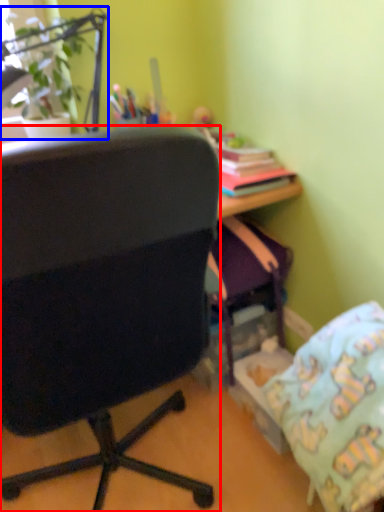
Question: Which object is further to the camera taking this photo, chair (highlighted by a red box) or houseplant (highlighted by a blue box)?

Choices:
 (A) chair
 (B) houseplant

Answer: (B)